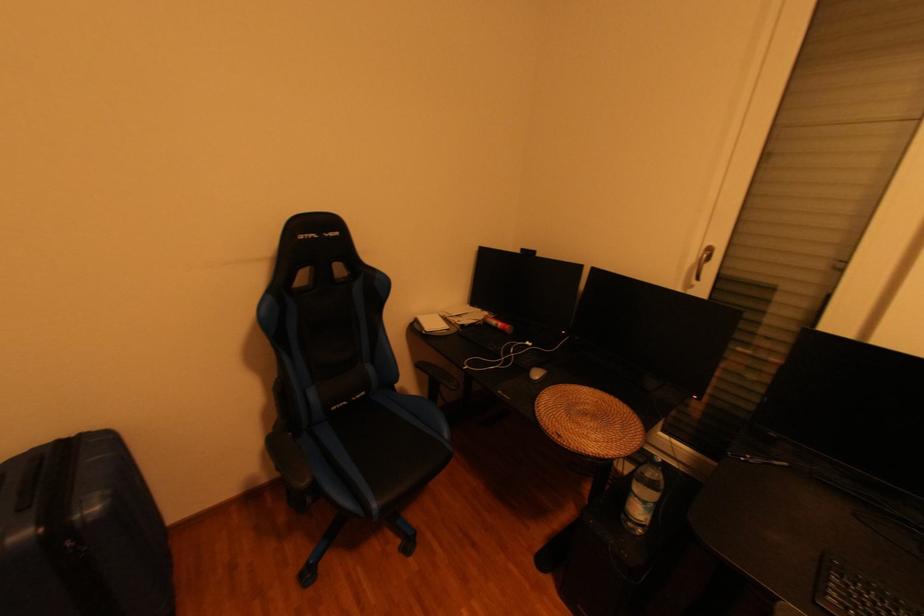
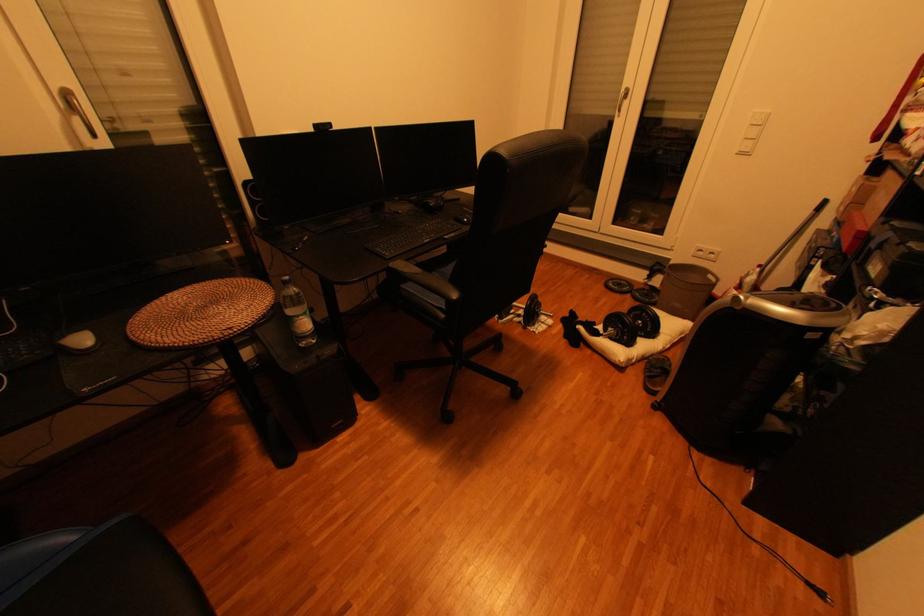
Locate, in the second image, the point that corresponds to pixel 648 500 in the first image.

(310, 318)